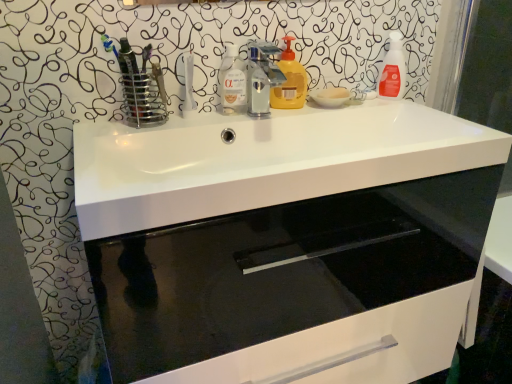
Question: Looking at the image, does white glossy sink at center seem bigger or smaller compared to transparent liquid at center, positioned as the first cleaning product in left-to-right order?

Choices:
 (A) small
 (B) big

Answer: (B)

Question: Which is correct: white glossy sink at center is inside transparent liquid at center, the third cleaning product when ordered from right to left, or outside of it?

Choices:
 (A) outside
 (B) inside

Answer: (A)

Question: Which of these objects is positioned closest to the transparent liquid at center, the third cleaning product when ordered from right to left?

Choices:
 (A) yellow matte liquid soap at center, which is the second cleaning product in right-to-left order
 (B) translucent orange spray bottle at upper right, which is counted as the first cleaning product, starting from the right
 (C) white glossy sink at center
 (D) white glossy cabinet at center
 (E) metallic silver faucet at center

Answer: (E)

Question: Which is nearer to the white glossy sink at center?

Choices:
 (A) yellow matte liquid soap at center, marked as the second cleaning product in a left-to-right arrangement
 (B) translucent orange spray bottle at upper right, which is counted as the first cleaning product, starting from the right
 (C) white glossy cabinet at center
 (D) metallic silver faucet at center
 (E) transparent liquid at center, positioned as the first cleaning product in left-to-right order

Answer: (A)